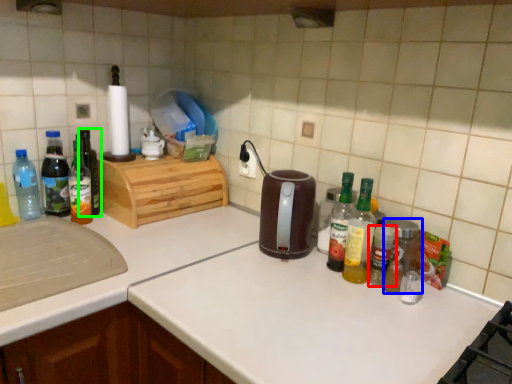
Question: Which object is the closest to the bottle (highlighted by a red box)? Choose among these: bottle (highlighted by a blue box) or bottle (highlighted by a green box).

Choices:
 (A) bottle
 (B) bottle

Answer: (A)